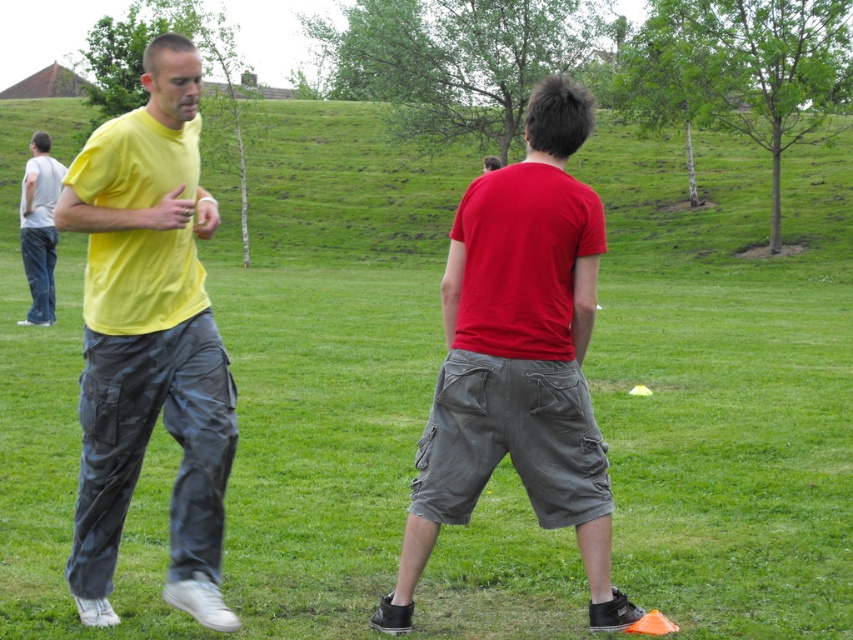
Can you confirm if matte red t-shirt at center is taller than denim jeans at left?

No, matte red t-shirt at center is not taller than denim jeans at left.

Who is taller, matte red t-shirt at center or denim jeans at left?

With more height is denim jeans at left.

Between point (556, 445) and point (24, 180), which one is positioned in front?

Point (556, 445) is more forward.

Locate an element on the screen. The width and height of the screenshot is (853, 640). matte red t-shirt at center is located at coordinates (519, 358).

Is matte yellow t-shirt at left taller than matte red t-shirt at center?

Indeed, matte yellow t-shirt at left has a greater height compared to matte red t-shirt at center.

At what (x,y) coordinates should I click in order to perform the action: click on matte yellow t-shirt at left. Please return your answer as a coordinate pair (x, y). Image resolution: width=853 pixels, height=640 pixels. Looking at the image, I should click on (149, 339).

Is matte yellow t-shirt at left below denim jeans at left?

Correct, matte yellow t-shirt at left is located below denim jeans at left.

Who is more distant from viewer, [221,440] or [51,216]?

The point [51,216] is behind.

Which is behind, point (96, 342) or point (30, 156)?

The point (30, 156) is behind.

Image resolution: width=853 pixels, height=640 pixels. I want to click on matte yellow t-shirt at left, so click(149, 339).